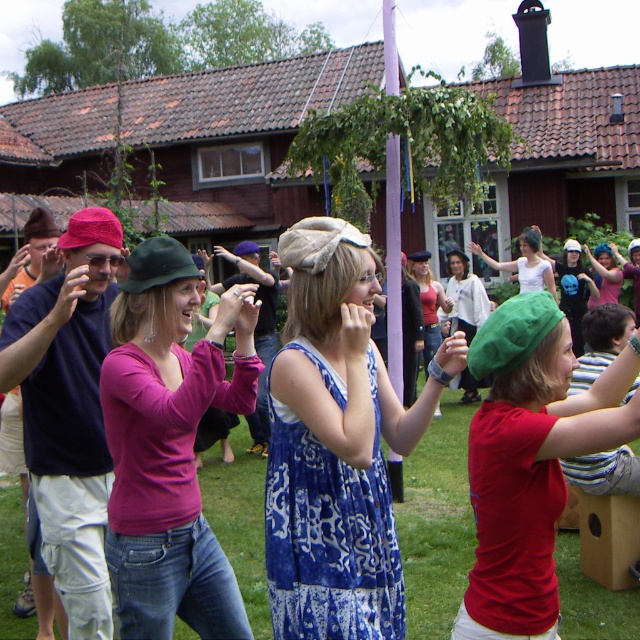
Question: Estimate the real-world distances between objects in this image. Which object is farther from the matte pink sweater at center?

Choices:
 (A) matte pink shirt at center
 (B) matte black hat at upper left
 (C) blue printed dress at center

Answer: (A)

Question: Which of these objects is positioned closest to the matte pink sweater at center?

Choices:
 (A) matte green beret at center
 (B) matte red tank top at center

Answer: (A)

Question: Does matte green beret at center appear on the left side of matte black hat at upper left?

Choices:
 (A) yes
 (B) no

Answer: (B)

Question: Which point is closer to the camera taking this photo?

Choices:
 (A) 609,273
 (B) 120,481
 (C) 531,285

Answer: (B)

Question: Does matte red tank top at center have a lesser width compared to white cotton dress at center?

Choices:
 (A) no
 (B) yes

Answer: (B)

Question: Can you confirm if matte red tank top at center is bigger than white cotton dress at center?

Choices:
 (A) yes
 (B) no

Answer: (A)